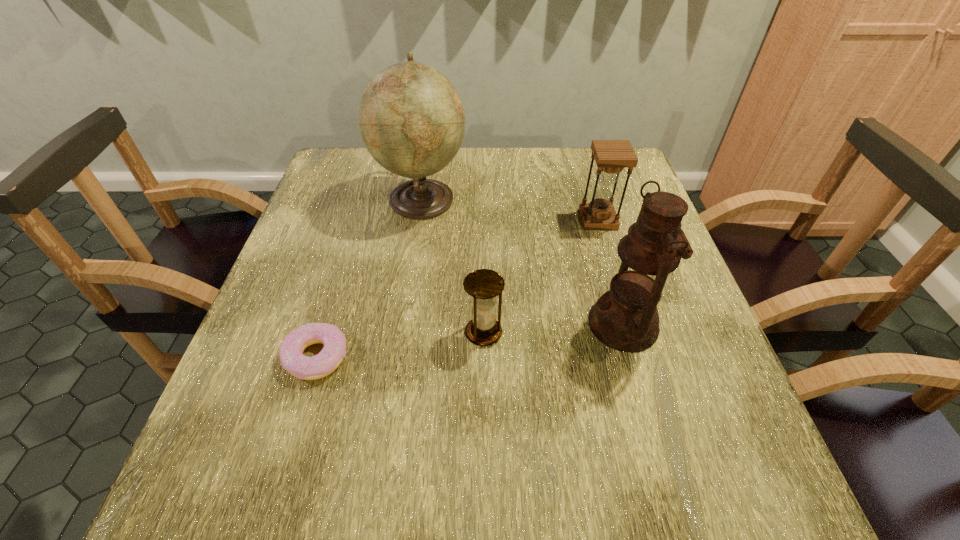
Locate an element on the screen. free space that is in between the third object from right to left and the right hourglass is located at coordinates (540, 276).

I want to click on object identified as the third closest to the farther hourglass, so click(484, 285).

Where is `object that is the third closest one to the globe`? The height and width of the screenshot is (540, 960). object that is the third closest one to the globe is located at coordinates (292, 359).

You are a GUI agent. You are given a task and a screenshot of the screen. Output one action in this format:
    pyautogui.click(x=<x>, y=<y>)
    Task: Click on the vacant space that satisfies the following two spatial constraints: 1. on the back side of the oil lamp; 2. on the front-facing side of the globe
    
    Given the screenshot: What is the action you would take?
    pyautogui.click(x=588, y=199)

The height and width of the screenshot is (540, 960). I want to click on free spot that satisfies the following two spatial constraints: 1. on the front-facing side of the oil lamp; 2. on the right side of the tallest object, so click(x=403, y=324).

The width and height of the screenshot is (960, 540). Identify the location of free point that satisfies the following two spatial constraints: 1. on the front-facing side of the nearer hourglass; 2. on the left side of the tallest object. (401, 333).

Where is `vacant area in the image that satisfies the following two spatial constraints: 1. on the front-facing side of the globe; 2. on the left side of the fourth tallest object`? The width and height of the screenshot is (960, 540). vacant area in the image that satisfies the following two spatial constraints: 1. on the front-facing side of the globe; 2. on the left side of the fourth tallest object is located at coordinates (401, 333).